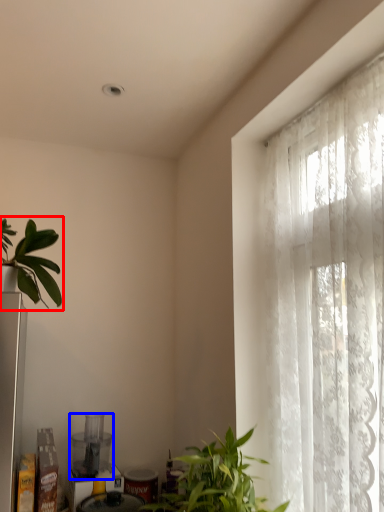
Question: Which object is further to the camera taking this photo, houseplant (highlighted by a red box) or appliance (highlighted by a blue box)?

Choices:
 (A) houseplant
 (B) appliance

Answer: (B)